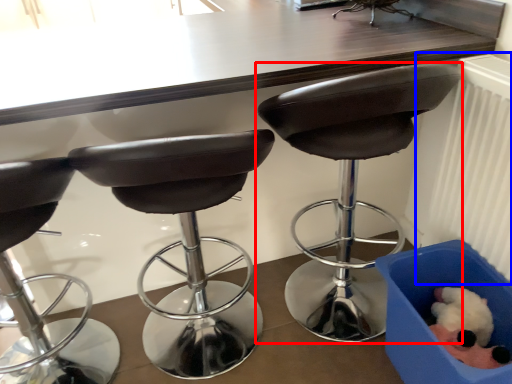
Question: Which object is closer to the camera taking this photo, chair (highlighted by a red box) or radiator (highlighted by a blue box)?

Choices:
 (A) chair
 (B) radiator

Answer: (B)